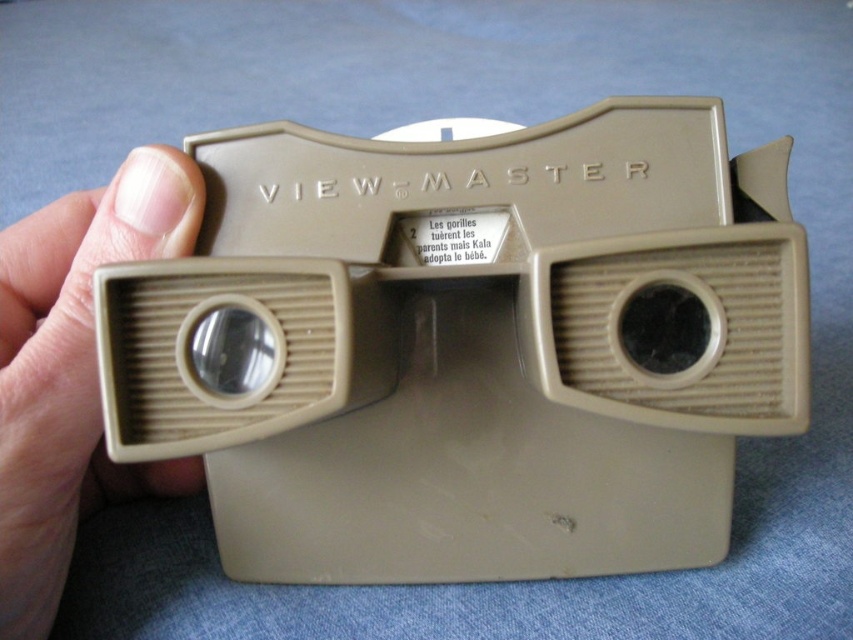
Looking at this image, which is more to the right, beige plastic view-master at center or pink skin at left?

From the viewer's perspective, beige plastic view-master at center appears more on the right side.

Who is taller, beige plastic view-master at center or pink skin at left?

pink skin at left

Who is more forward, (381, 528) or (28, 432)?

Point (28, 432) is more forward.

You are a GUI agent. You are given a task and a screenshot of the screen. Output one action in this format:
    pyautogui.click(x=<x>, y=<y>)
    Task: Click on the beige plastic view-master at center
    Image resolution: width=853 pixels, height=640 pixels.
    Given the screenshot: What is the action you would take?
    pyautogui.click(x=477, y=346)

Can you confirm if beige plastic view-master at center is wider than matte plastic lens at center left?

Indeed, beige plastic view-master at center has a greater width compared to matte plastic lens at center left.

Does beige plastic view-master at center appear on the left side of matte plastic lens at center left?

Incorrect, beige plastic view-master at center is not on the left side of matte plastic lens at center left.

Find the location of a particular element. Image resolution: width=853 pixels, height=640 pixels. beige plastic view-master at center is located at coordinates (477, 346).

This screenshot has width=853, height=640. I want to click on beige plastic view-master at center, so (x=477, y=346).

Is pink skin at left wider than matte plastic lens at center left?

Yes.

Can you confirm if pink skin at left is shorter than matte plastic lens at center left?

In fact, pink skin at left may be taller than matte plastic lens at center left.

Does point (18, 496) come farther from viewer compared to point (180, 374)?

Yes, point (18, 496) is behind point (180, 374).

In order to click on pink skin at left in this screenshot , I will do `click(73, 371)`.